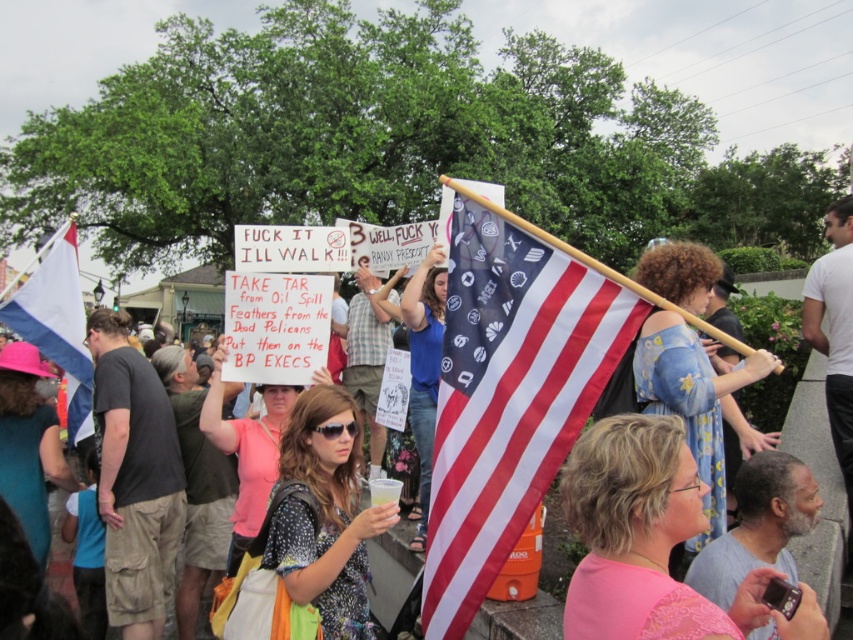
Question: Does american flag at center have a greater width compared to pink lace dress at center?

Choices:
 (A) no
 (B) yes

Answer: (B)

Question: Is pink lace dress at center wider than pink fabric shirt at center?

Choices:
 (A) no
 (B) yes

Answer: (A)

Question: Which object appears closest to the camera in this image?

Choices:
 (A) pink fabric shirt at center
 (B) american flag at center

Answer: (B)

Question: Can you confirm if pink fabric shirt at center is positioned below blue cotton shirt at center?

Choices:
 (A) yes
 (B) no

Answer: (A)

Question: Which object appears farthest from the camera in this image?

Choices:
 (A) pink lace dress at center
 (B) american flag at center

Answer: (B)

Question: Which point is closer to the camera?

Choices:
 (A) polka dot fabric dress at center
 (B) american flag at center
 (C) pink fabric hat at upper left

Answer: (A)